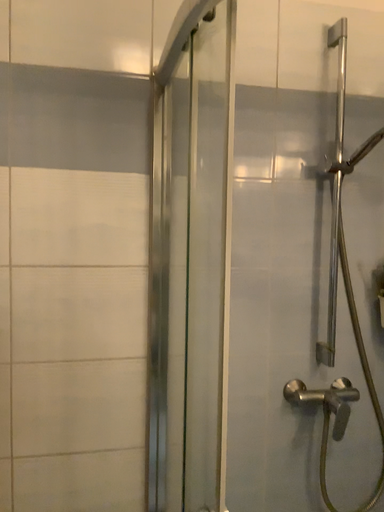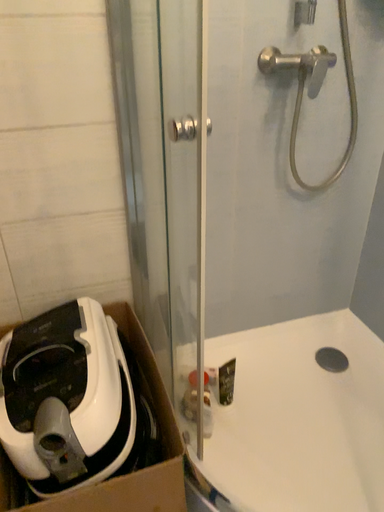
Question: Which way did the camera rotate in the video?

Choices:
 (A) rotated downward
 (B) rotated upward

Answer: (A)